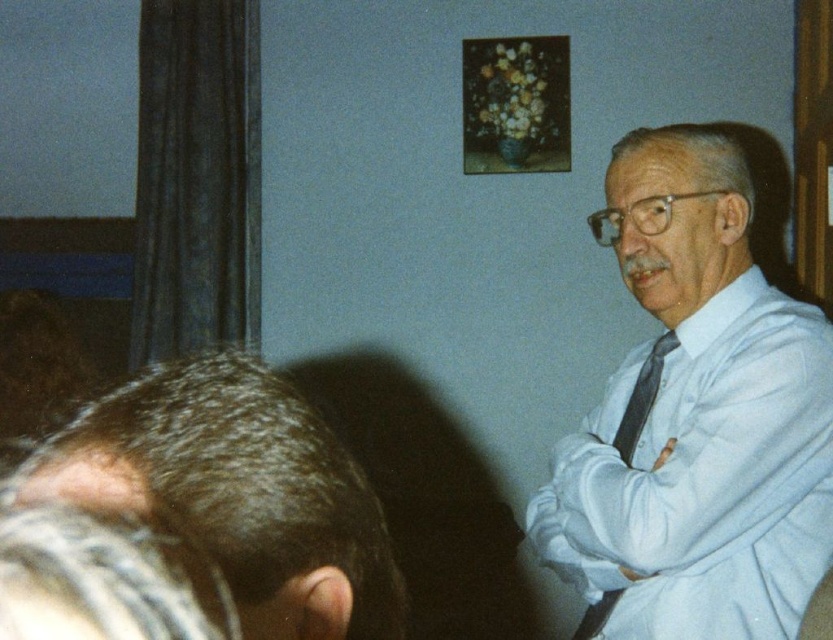
Who is higher up, white shirt at center or dark brown hair at lower left?

white shirt at center

Who is positioned more to the left, white shirt at center or dark brown hair at lower left?

dark brown hair at lower left

Is point (641, 500) behind point (298, 541)?

Yes, point (641, 500) is farther from viewer.

At what (x,y) coordinates should I click in order to perform the action: click on white shirt at center. Please return your answer as a coordinate pair (x, y). Image resolution: width=833 pixels, height=640 pixels. Looking at the image, I should click on (696, 419).

Who is positioned more to the right, white shirt at center or gray hair at lower left?

Positioned to the right is white shirt at center.

Who is shorter, white shirt at center or gray hair at lower left?

gray hair at lower left is shorter.

The image size is (833, 640). What do you see at coordinates (696, 419) in the screenshot?
I see `white shirt at center` at bounding box center [696, 419].

In order to click on white shirt at center in this screenshot , I will do `click(696, 419)`.

Does dark brown hair at lower left have a larger size compared to black silk tie at right?

Yes.

Is point (155, 452) positioned in front of point (622, 422)?

Yes, it is in front of point (622, 422).

Is point (278, 512) closer to viewer compared to point (636, 435)?

Yes, it is.

What are the coordinates of `dark brown hair at lower left` in the screenshot? It's located at (252, 480).